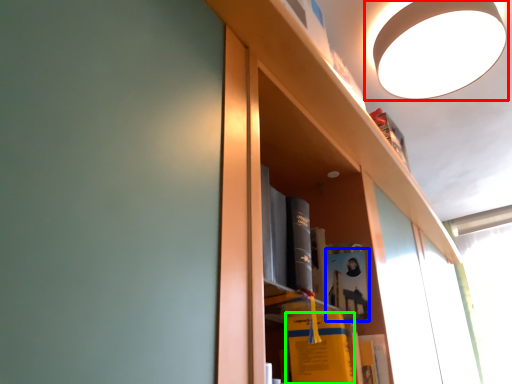
Question: Based on their relative distances, which object is nearer to lamp (highlighted by a red box)? Choose from book (highlighted by a blue box) and book (highlighted by a green box).

Choices:
 (A) book
 (B) book

Answer: (A)